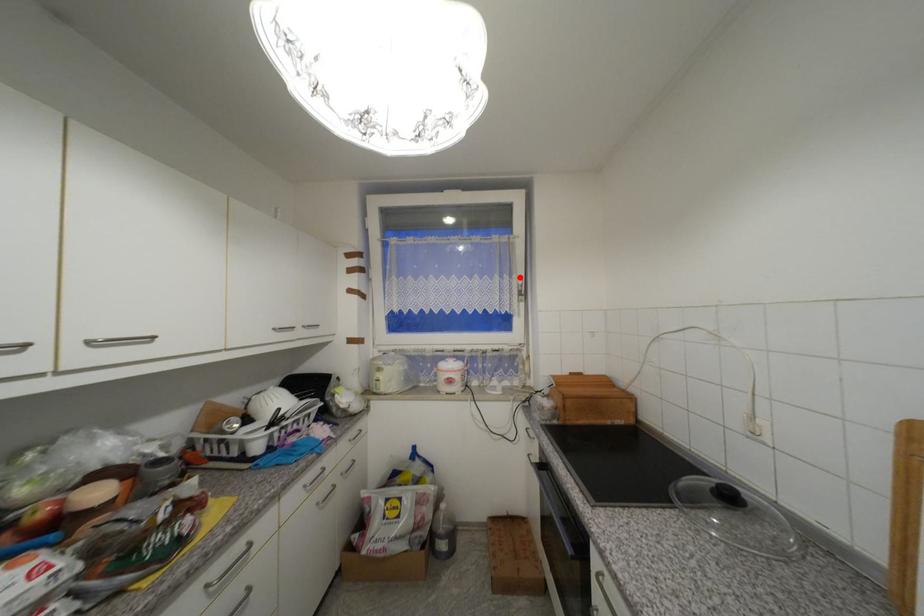
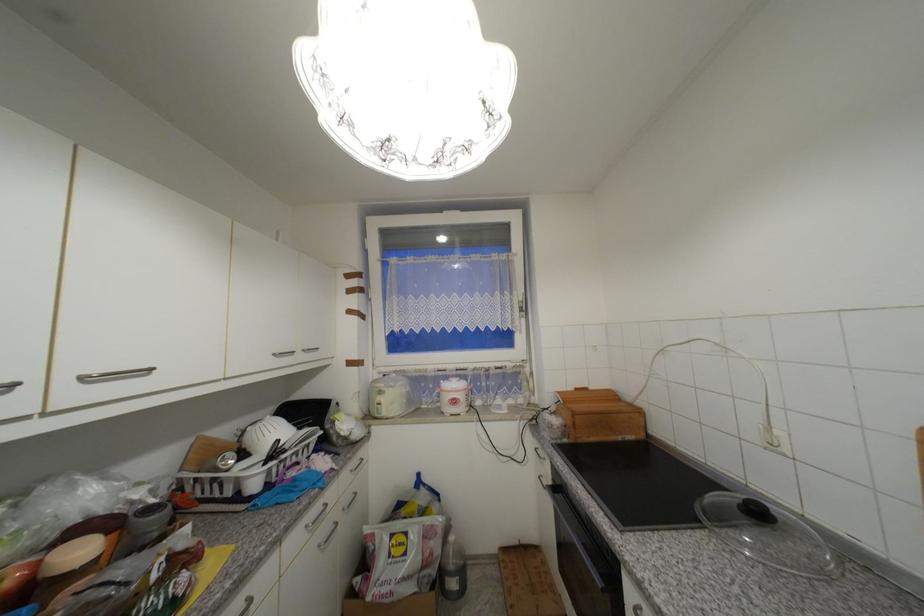
In the second image, find the point that corresponds to the highlighted location in the first image.

(520, 294)